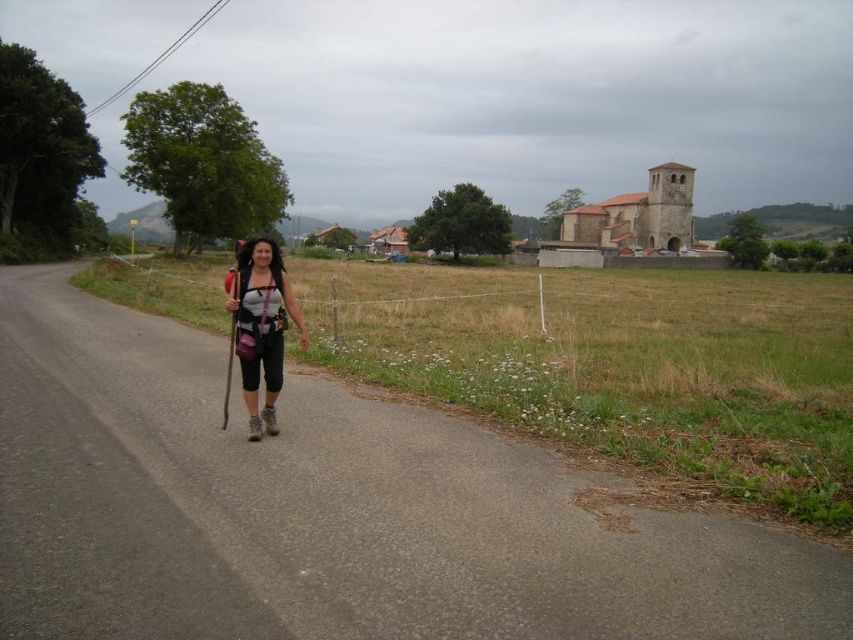
Does matte black backpack at center have a smaller size compared to wooden ski pole at center?

Indeed, matte black backpack at center has a smaller size compared to wooden ski pole at center.

Who is more distant from viewer, [254,349] or [227,420]?

The point [227,420] is more distant.

The image size is (853, 640). I want to click on matte black backpack at center, so click(x=260, y=326).

Who is more forward, (416,564) or (270,365)?

Point (416,564) is in front.

Based on the photo, who is taller, gray asphalt road at center or matte black backpack at center?

matte black backpack at center is taller.

Between point (368, 566) and point (241, 342), which one is positioned in front?

Positioned in front is point (368, 566).

Locate an element on the screen. Image resolution: width=853 pixels, height=640 pixels. gray asphalt road at center is located at coordinates (329, 512).

Does gray asphalt road at center have a smaller size compared to wooden ski pole at center?

Yes, gray asphalt road at center is smaller than wooden ski pole at center.

Is point (401, 435) in front of point (225, 292)?

Yes, point (401, 435) is closer to viewer.

Locate an element on the screen. gray asphalt road at center is located at coordinates (329, 512).